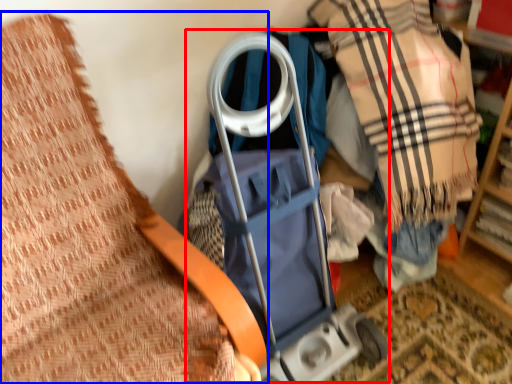
Question: Which point is further to the camera, baby carriage (highlighted by a red box) or furniture (highlighted by a blue box)?

Choices:
 (A) baby carriage
 (B) furniture

Answer: (A)